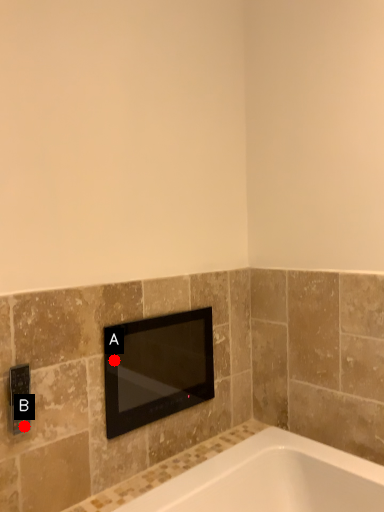
Question: Two points are circled on the image, labeled by A and B beside each circle. Which of the following is the farthest from the observer?

Choices:
 (A) A is further
 (B) B is further

Answer: (A)